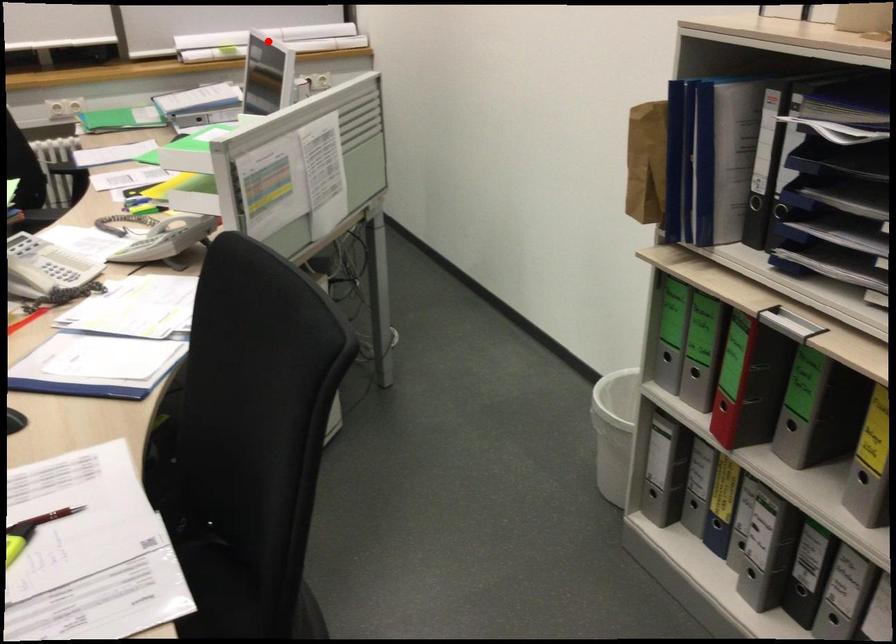
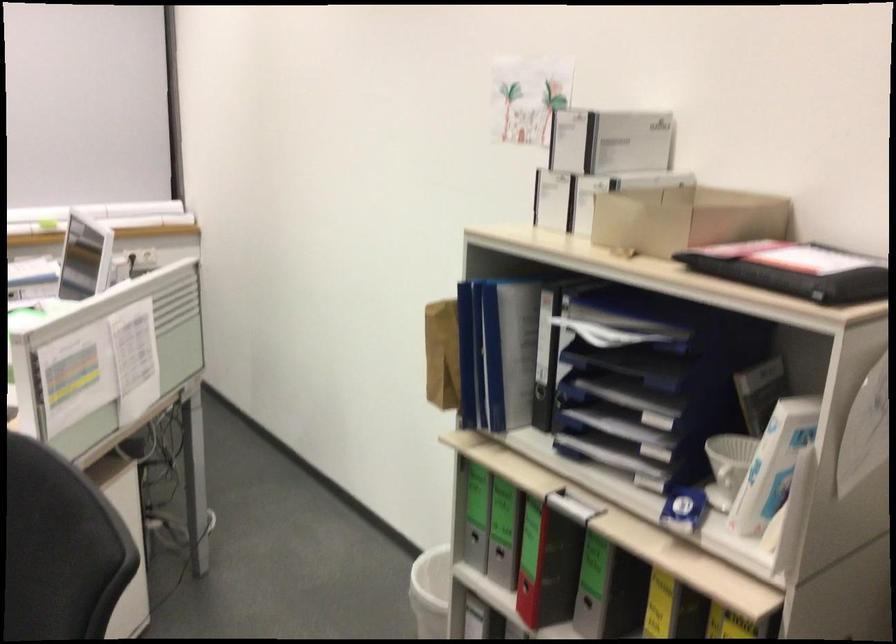
Question: I am providing you with two images of the same scene from different viewpoints. A red point is marked on the first image. At the location where the point appears in image 1, is it still visible in image 2?

Choices:
 (A) Yes
 (B) No

Answer: (B)